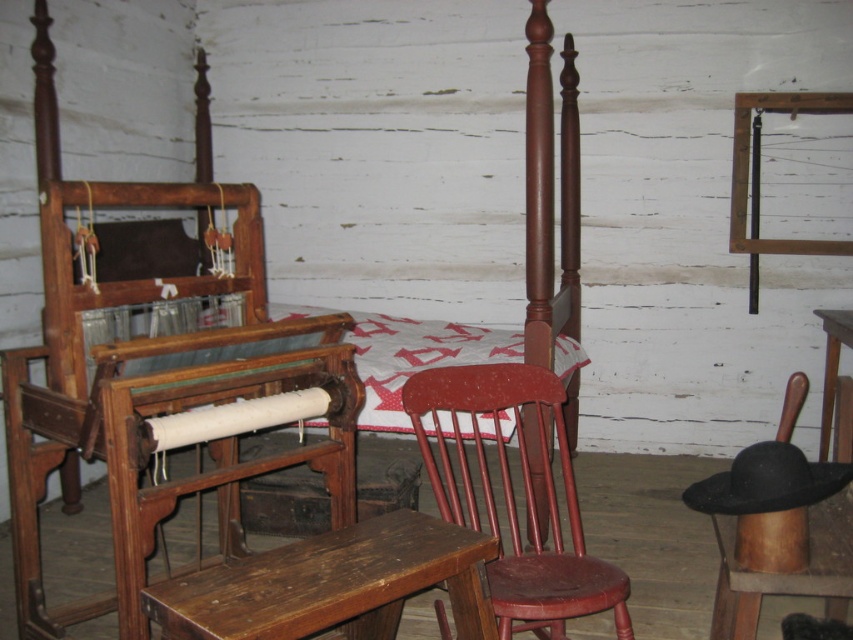
Can you confirm if wooden bench at center is smaller than matte red wooden chair at center?

Correct, wooden bench at center occupies less space than matte red wooden chair at center.

Can you confirm if wooden bench at center is shorter than matte red wooden chair at center?

Yes.

The image size is (853, 640). Find the location of `wooden bench at center`. wooden bench at center is located at coordinates (334, 584).

Who is taller, matte red wooden chair at center or wooden table at lower right?

Standing taller between the two is matte red wooden chair at center.

Does point (508, 627) lie behind point (831, 314)?

That is False.

I want to click on matte red wooden chair at center, so click(x=514, y=496).

What are the coordinates of `matte red wooden chair at center` in the screenshot? It's located at (514, 496).

Which is below, wooden bench at center or wooden table at lower right?

wooden bench at center is below.

Is point (460, 529) closer to viewer compared to point (836, 360)?

Yes, point (460, 529) is closer to viewer.

Between point (192, 621) and point (846, 342), which one is positioned behind?

Point (846, 342)

I want to click on wooden bench at center, so click(x=334, y=584).